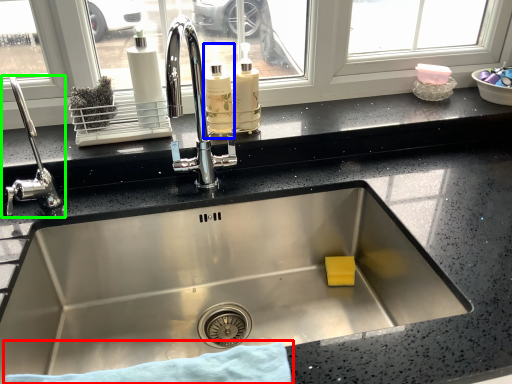
Question: Based on their relative distances, which object is farther from bath towel (highlighted by a red box)? Choose from bottle (highlighted by a blue box) and tap (highlighted by a green box).

Choices:
 (A) bottle
 (B) tap

Answer: (A)